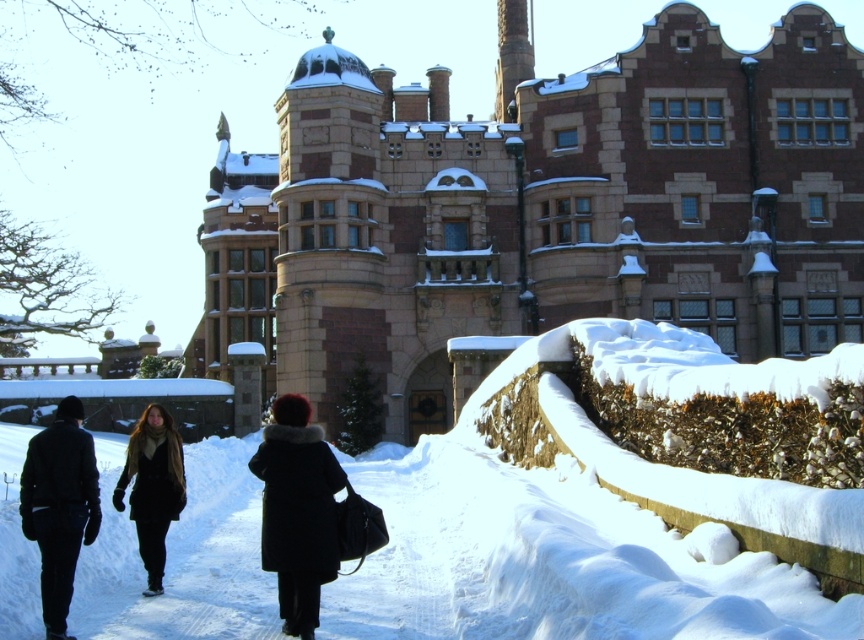
Question: Can you confirm if dark brown leather coat at lower left is bigger than velvet black coat at center?

Choices:
 (A) yes
 (B) no

Answer: (B)

Question: Estimate the real-world distances between objects in this image. Which object is farther from the dark brown leather coat at lower left?

Choices:
 (A) velvet black coat at center
 (B) velvet brown coat at center

Answer: (A)

Question: Does dark brown leather coat at lower left appear under velvet black coat at center?

Choices:
 (A) yes
 (B) no

Answer: (A)

Question: From the image, what is the correct spatial relationship of dark wool coat at center in relation to velvet black coat at center?

Choices:
 (A) left
 (B) right

Answer: (A)

Question: Which point is farther to the camera?

Choices:
 (A) dark brown leather coat at lower left
 (B) dark wool coat at center
 (C) velvet black coat at center
 (D) velvet brown coat at center

Answer: (D)

Question: Based on their relative distances, which object is nearer to the velvet black coat at center?

Choices:
 (A) dark brown leather coat at lower left
 (B) dark wool coat at center

Answer: (A)